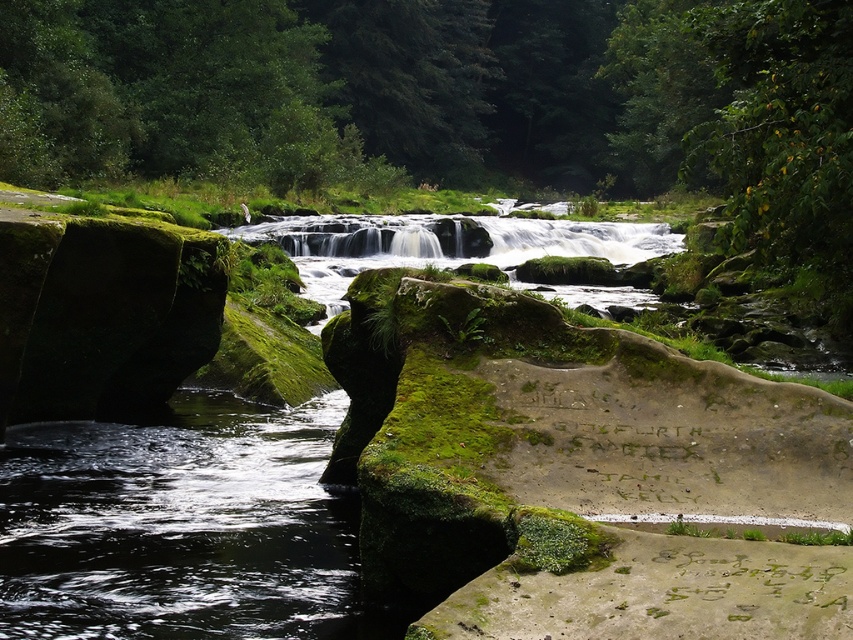
Question: Does clear water at center appear under white smooth water at center?

Choices:
 (A) no
 (B) yes

Answer: (B)

Question: Is the position of clear water at center more distant than that of white smooth water at center?

Choices:
 (A) no
 (B) yes

Answer: (A)

Question: Does clear water at center have a greater width compared to white smooth water at center?

Choices:
 (A) yes
 (B) no

Answer: (B)

Question: Which point is closer to the camera?

Choices:
 (A) (86, 433)
 (B) (537, 248)

Answer: (A)

Question: Which object appears closest to the camera in this image?

Choices:
 (A) white smooth water at center
 (B) clear water at center

Answer: (B)

Question: Which point is farther from the camera taking this photo?

Choices:
 (A) click(x=268, y=493)
 (B) click(x=439, y=218)

Answer: (B)